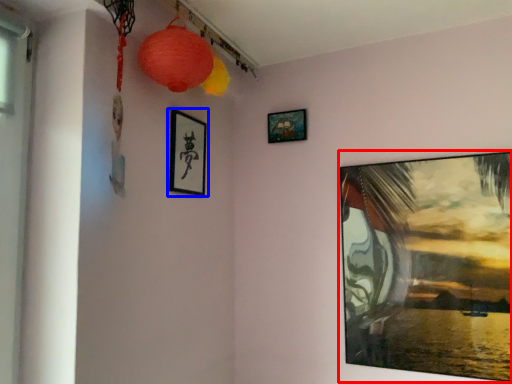
Question: Which point is closer to the camera, picture frame (highlighted by a red box) or picture frame (highlighted by a blue box)?

Choices:
 (A) picture frame
 (B) picture frame

Answer: (A)